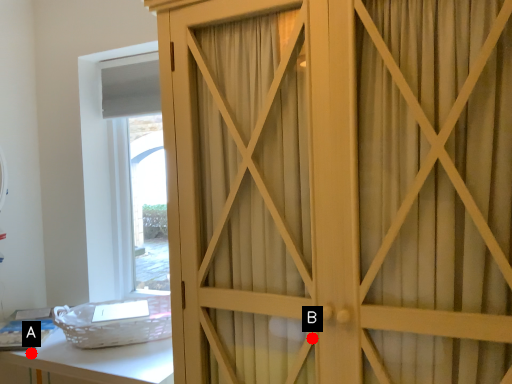
Question: Two points are circled on the image, labeled by A and B beside each circle. Which point appears farthest from the camera in this image?

Choices:
 (A) A is further
 (B) B is further

Answer: (A)